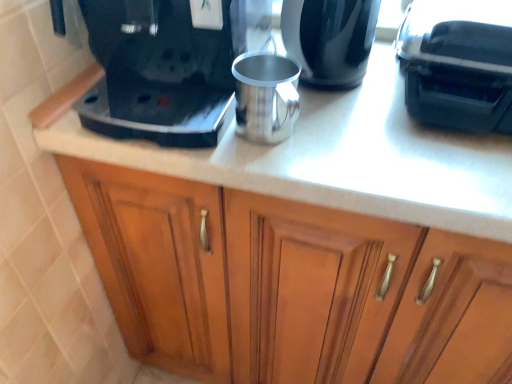
Question: In the image, is shiny black kettle at upper center on the left side or the right side of black plastic coffee maker at upper left?

Choices:
 (A) right
 (B) left

Answer: (A)

Question: Is point (334, 34) positioned closer to the camera than point (77, 102)?

Choices:
 (A) farther
 (B) closer

Answer: (B)

Question: Estimate the real-world distances between objects in this image. Which object is closer to the black plastic coffee machine at upper right?

Choices:
 (A) black plastic coffee maker at upper left
 (B) wooden cabinet at center
 (C) polished metal mug at center
 (D) shiny black kettle at upper center

Answer: (D)

Question: Estimate the real-world distances between objects in this image. Which object is farther from the shiny black kettle at upper center?

Choices:
 (A) black plastic coffee machine at upper right
 (B) polished metal mug at center
 (C) black plastic coffee maker at upper left
 (D) wooden cabinet at center

Answer: (D)